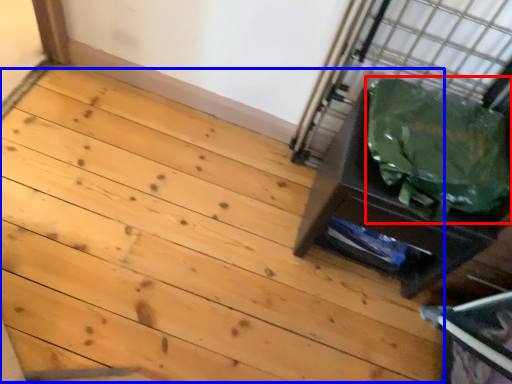
Question: Among these objects, which one is nearest to the camera, garbage (highlighted by a red box) or stairwell (highlighted by a blue box)?

Choices:
 (A) garbage
 (B) stairwell

Answer: (A)